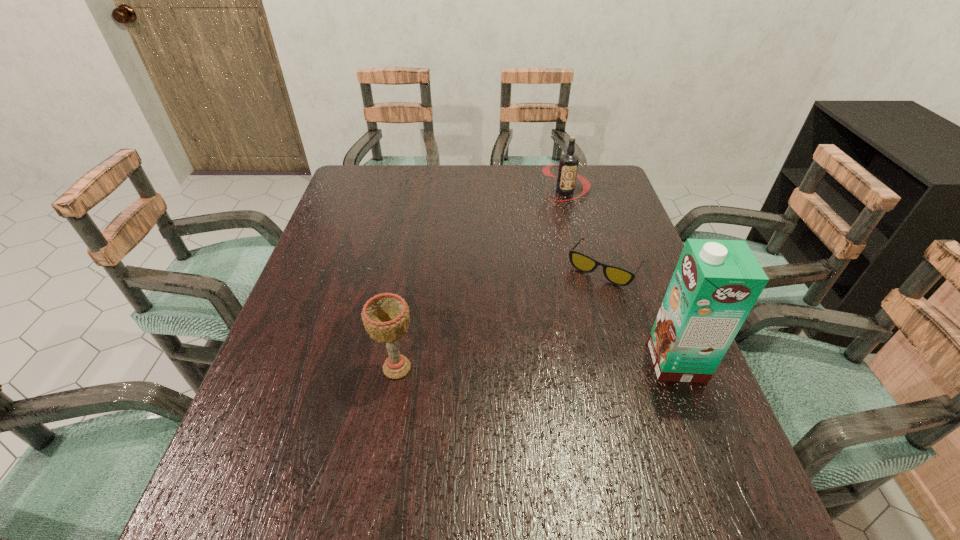
Where is `free spot on the desktop that is between the leftmost object and the tallest object and is positioned on the front-facing side of the shortest object`? This screenshot has width=960, height=540. free spot on the desktop that is between the leftmost object and the tallest object and is positioned on the front-facing side of the shortest object is located at coordinates (540, 364).

Where is `vacant space on the desktop that is between the chalice and the tallest object and is positioned on the label of the farthest object`? The image size is (960, 540). vacant space on the desktop that is between the chalice and the tallest object and is positioned on the label of the farthest object is located at coordinates (545, 364).